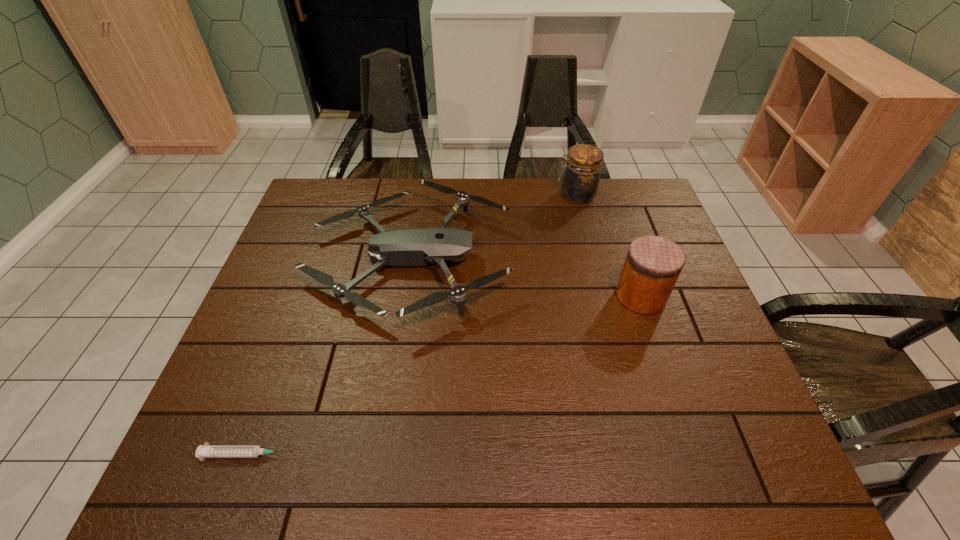
The width and height of the screenshot is (960, 540). I want to click on free space located 0.130m at the needle end of the syringe, so click(357, 454).

Identify the location of jar located at the far edge. This screenshot has height=540, width=960. (580, 182).

Identify the location of drone positioned at the far edge. The image size is (960, 540). (405, 247).

At what (x,y) coordinates should I click in order to perform the action: click on object that is at the near edge. Please return your answer as a coordinate pair (x, y). This screenshot has height=540, width=960. Looking at the image, I should click on (204, 451).

Find the location of a particular element. This screenshot has height=540, width=960. drone positioned at the left edge is located at coordinates (405, 247).

You are a GUI agent. You are given a task and a screenshot of the screen. Output one action in this format:
    pyautogui.click(x=<x>, y=<y>)
    Task: Click on the syringe that is at the left edge
    
    Given the screenshot: What is the action you would take?
    pyautogui.click(x=204, y=451)

At what (x,y) coordinates should I click in order to perform the action: click on object situated at the right edge. Please return your answer as a coordinate pair (x, y). This screenshot has width=960, height=540. Looking at the image, I should click on (653, 264).

Where is `object present at the far left corner`? object present at the far left corner is located at coordinates (405, 247).

The width and height of the screenshot is (960, 540). I want to click on object located at the near left corner, so click(x=204, y=451).

In the image, there is a desktop. Where is `vacant space at the far edge`? The width and height of the screenshot is (960, 540). vacant space at the far edge is located at coordinates 538,211.